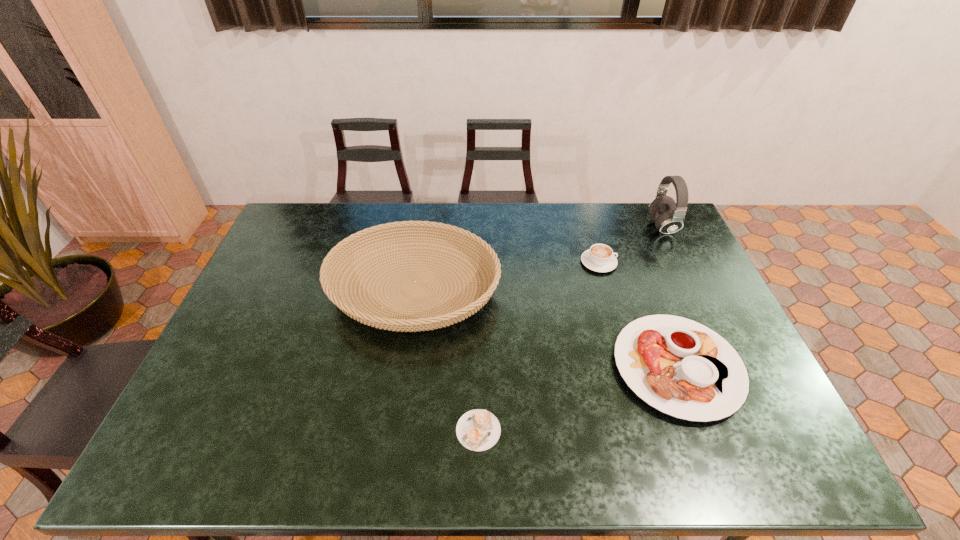
Where is `the farthest object`? the farthest object is located at coordinates (669, 217).

Find the location of a particular element. headset is located at coordinates (669, 217).

The width and height of the screenshot is (960, 540). Find the location of `the second tallest object`. the second tallest object is located at coordinates (429, 320).

I want to click on the right cappuccino, so click(x=600, y=258).

Locate an element on the screen. the taller cappuccino is located at coordinates (600, 258).

Locate an element on the screen. This screenshot has width=960, height=540. the second shortest object is located at coordinates (682, 368).

Where is `the shortest object`? the shortest object is located at coordinates (478, 430).

This screenshot has height=540, width=960. In order to click on the nearer cappuccino in this screenshot , I will do `click(478, 430)`.

Where is `free spot located on the ear cups of the headset`? free spot located on the ear cups of the headset is located at coordinates (607, 226).

The height and width of the screenshot is (540, 960). What are the coordinates of `vacant space located on the ear cups of the headset` in the screenshot? It's located at (623, 226).